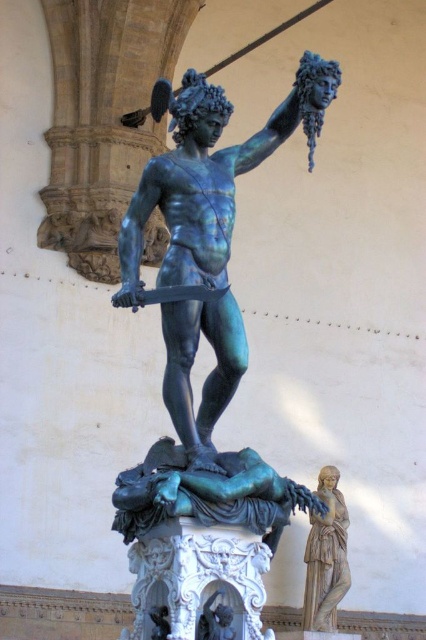
Does bronze warrior at center have a larger size compared to smooth beige statue at right?

Correct, bronze warrior at center is larger in size than smooth beige statue at right.

Is bronze warrior at center wider than smooth beige statue at right?

Yes.

Between point (192, 234) and point (310, 588), which one is positioned behind?

The point (310, 588) is behind.

You are a GUI agent. You are given a task and a screenshot of the screen. Output one action in this format:
    pyautogui.click(x=<x>, y=<y>)
    Task: Click on the bronze warrior at center
    
    Given the screenshot: What is the action you would take?
    pyautogui.click(x=207, y=234)